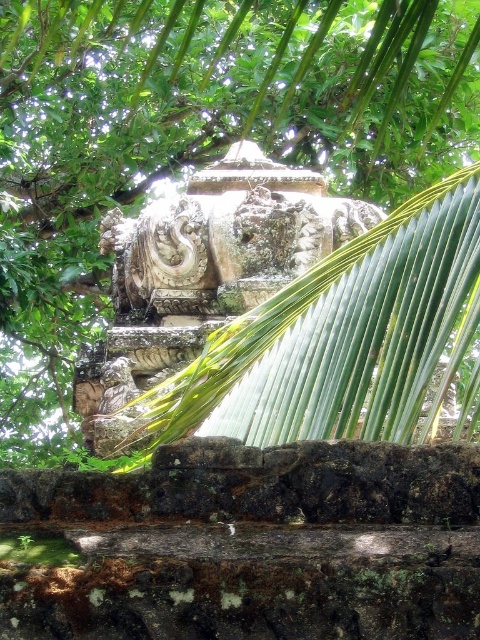
From the picture: You are an archaeologist examining the ancient stone structure. You notice the green leafy tree at upper center and the carved stone sculpture at center. Which object would cast a larger shadow on the ground during midday?

The green leafy tree at upper center might cast a larger shadow than the carved stone sculpture at center since it might be wider according to the description.

You are an archaeologist examining the ancient stone structure. You notice the green leafy tree at upper center and the carved stone sculpture at center. Which object would cast a larger shadow given their sizes?

The green leafy tree at upper center is larger in size than the carved stone sculpture at center, so it would cast a larger shadow.